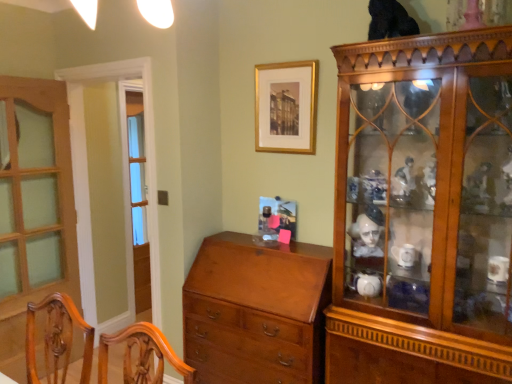
Image resolution: width=512 pixels, height=384 pixels. What do you see at coordinates (256, 311) in the screenshot?
I see `shiny brown chest of drawers at center` at bounding box center [256, 311].

The width and height of the screenshot is (512, 384). What do you see at coordinates (286, 107) in the screenshot?
I see `gold framed picture at upper center` at bounding box center [286, 107].

This screenshot has width=512, height=384. What are the coordinates of `mahogany wood chair at lower left` in the screenshot? It's located at (57, 337).

Locate an element on the screen. This screenshot has height=384, width=512. clear glass screen door at left is located at coordinates (127, 152).

Identify the location of shiny brown chest of drawers at center. (256, 311).

Considering the relative positions of mahogany wood chair at lower left and clear glass screen door at left in the image provided, is mahogany wood chair at lower left behind clear glass screen door at left?

No, mahogany wood chair at lower left is closer to the camera.

How many degrees apart are the facing directions of mahogany wood chair at lower left and clear glass screen door at left?

0.21 degrees.

Does mahogany wood chair at lower left have a lesser width compared to clear glass screen door at left?

No, mahogany wood chair at lower left is not thinner than clear glass screen door at left.

Considering the relative sizes of mahogany wood chair at lower left and clear glass screen door at left in the image provided, is mahogany wood chair at lower left bigger than clear glass screen door at left?

Incorrect, mahogany wood chair at lower left is not larger than clear glass screen door at left.

How many degrees apart are the facing directions of wooden door at left and shiny brown chest of drawers at center?

They differ by 89.1 degrees in their facing directions.

Considering the sizes of wooden door at left and shiny brown chest of drawers at center in the image, is wooden door at left bigger or smaller than shiny brown chest of drawers at center?

→ In the image, wooden door at left appears to be smaller than shiny brown chest of drawers at center.

Considering the sizes of objects wooden door at left and shiny brown chest of drawers at center in the image provided, who is wider, wooden door at left or shiny brown chest of drawers at center?

shiny brown chest of drawers at center is wider.

Does wooden door at left lie in front of shiny brown chest of drawers at center?

No, wooden door at left is behind shiny brown chest of drawers at center.

Is gold framed picture at upper center aimed at black fur cat at upper center?

No, gold framed picture at upper center does not turn towards black fur cat at upper center.

From the image's perspective, is gold framed picture at upper center located beneath black fur cat at upper center?

Indeed, from the image's perspective, gold framed picture at upper center is shown beneath black fur cat at upper center.

What's the angular difference between gold framed picture at upper center and black fur cat at upper center's facing directions?

gold framed picture at upper center and black fur cat at upper center are facing 3.27 degrees away from each other.

Which of these two, gold framed picture at upper center or black fur cat at upper center, is bigger?

Bigger between the two is gold framed picture at upper center.

Is clear glass screen door at left in contact with wooden cabinet at right?

No, clear glass screen door at left is not in contact with wooden cabinet at right.

Considering the relative sizes of clear glass screen door at left and wooden cabinet at right in the image provided, is clear glass screen door at left wider than wooden cabinet at right?

Incorrect, the width of clear glass screen door at left does not surpass that of wooden cabinet at right.

In the scene shown: Does clear glass screen door at left have a greater height compared to wooden cabinet at right?

Indeed, clear glass screen door at left has a greater height compared to wooden cabinet at right.

From the image's perspective, relative to wooden cabinet at right, is black fur cat at upper center above or below?

Based on their image positions, black fur cat at upper center is located above wooden cabinet at right.

Is black fur cat at upper center completely or partially outside of wooden cabinet at right?

Absolutely, black fur cat at upper center is external to wooden cabinet at right.

Based on their positions, is black fur cat at upper center located to the left or right of wooden cabinet at right?

Based on their positions, black fur cat at upper center is located to the left of wooden cabinet at right.

Who is bigger, gold framed picture at upper center or wooden cabinet at right?

With larger size is wooden cabinet at right.

Does gold framed picture at upper center turn towards wooden cabinet at right?

No.

How distant is gold framed picture at upper center from wooden cabinet at right?

They are 24.86 inches apart.

In terms of width, does gold framed picture at upper center look wider or thinner when compared to wooden cabinet at right?

Considering their sizes, gold framed picture at upper center looks slimmer than wooden cabinet at right.

Considering the positions of points (188, 361) and (150, 177), is point (188, 361) farther from camera compared to point (150, 177)?

No, it is not.

Can you confirm if shiny brown chest of drawers at center is taller than clear glass screen door at left?

No.

Would you say shiny brown chest of drawers at center is inside or outside clear glass screen door at left?

shiny brown chest of drawers at center is not inside clear glass screen door at left, it's outside.

Considering the sizes of objects shiny brown chest of drawers at center and clear glass screen door at left in the image provided, who is smaller, shiny brown chest of drawers at center or clear glass screen door at left?

Smaller between the two is clear glass screen door at left.

This screenshot has height=384, width=512. I want to click on screen door above the mahogany wood chair at lower left (from the image's perspective), so click(127, 152).

I want to click on chest of drawers located on the right of wooden door at left, so click(256, 311).

Considering their positions, is mahogany wood chair at lower left positioned closer to gold framed picture at upper center than clear glass screen door at left?

clear glass screen door at left lies closer to gold framed picture at upper center than the other object.

Looking at the image, which one is located closer to wooden door at left, mahogany wood chair at lower left or black fur cat at upper center?

mahogany wood chair at lower left lies closer to wooden door at left than the other object.

Based on their spatial positions, is black fur cat at upper center or shiny brown chest of drawers at center closer to wooden door at left?

The object closer to wooden door at left is shiny brown chest of drawers at center.

In the scene shown: Considering their positions, is wooden door at left positioned closer to wooden cabinet at right than gold framed picture at upper center?

gold framed picture at upper center is positioned closer to the anchor wooden cabinet at right.

Which object lies nearer to the anchor point mahogany wood chair at lower left, black fur cat at upper center or clear glass screen door at left?

clear glass screen door at left lies closer to mahogany wood chair at lower left than the other object.

Looking at this image, looking at the image, which one is located closer to clear glass screen door at left, wooden door at left or black fur cat at upper center?

The object closer to clear glass screen door at left is wooden door at left.

Considering their positions, is gold framed picture at upper center positioned closer to shiny brown chest of drawers at center than wooden cabinet at right?

The object closer to shiny brown chest of drawers at center is wooden cabinet at right.

From the image, which object appears to be nearer to mahogany wood chair at lower left, clear glass screen door at left or black fur cat at upper center?

clear glass screen door at left is closer to mahogany wood chair at lower left.

At what (x,y) coordinates should I click in order to perform the action: click on chair located between wooden door at left and wooden cabinet at right in the left-right direction. Please return your answer as a coordinate pair (x, y). The image size is (512, 384). Looking at the image, I should click on (57, 337).

This screenshot has height=384, width=512. I want to click on animal situated between mahogany wood chair at lower left and wooden cabinet at right from left to right, so click(x=390, y=20).

I want to click on picture frame between clear glass screen door at left and black fur cat at upper center from left to right, so click(x=286, y=107).

Where is `chest of drawers between wooden door at left and black fur cat at upper center in the horizontal direction`? This screenshot has height=384, width=512. chest of drawers between wooden door at left and black fur cat at upper center in the horizontal direction is located at coordinates (256, 311).